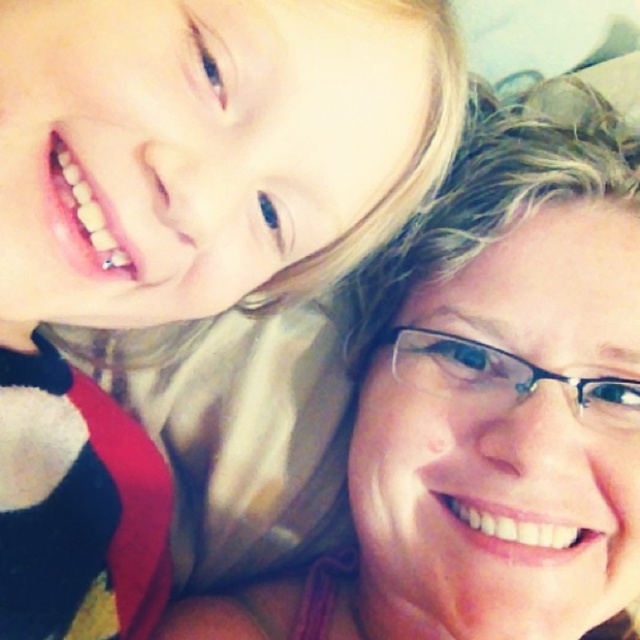
Question: Can you confirm if matte black shirt at upper left is positioned to the right of matte skin at upper right?

Choices:
 (A) yes
 (B) no

Answer: (B)

Question: Is matte black shirt at upper left further to camera compared to matte skin at upper right?

Choices:
 (A) no
 (B) yes

Answer: (A)

Question: Can you confirm if matte black shirt at upper left is positioned above matte skin at upper right?

Choices:
 (A) yes
 (B) no

Answer: (A)